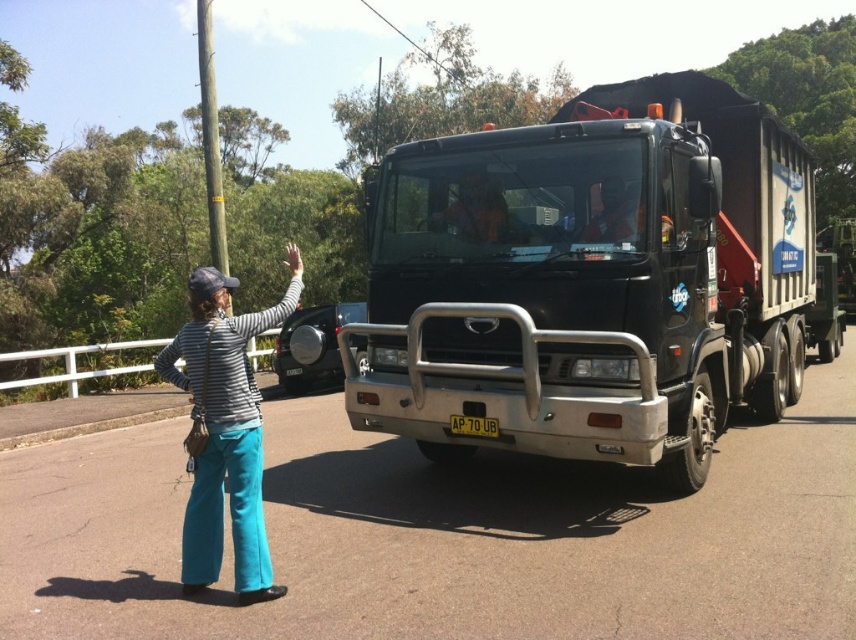
Question: Is black metallic truck at center above yellow plastic license plate at center?

Choices:
 (A) no
 (B) yes

Answer: (B)

Question: Is black metallic truck at center closer to the viewer compared to yellow plastic license plate at center?

Choices:
 (A) yes
 (B) no

Answer: (A)

Question: Which object is closer to the camera taking this photo?

Choices:
 (A) black metallic truck at center
 (B) yellow plastic license plate at center
 (C) striped fabric shirt at left

Answer: (C)

Question: From the image, what is the correct spatial relationship of striped fabric shirt at left in relation to yellow plastic license plate at center?

Choices:
 (A) below
 (B) above

Answer: (B)

Question: Which of the following is the closest to the observer?

Choices:
 (A) black metallic truck at center
 (B) yellow plastic license plate at center

Answer: (A)

Question: Among these points, which one is farthest from the camera?

Choices:
 (A) (702, 122)
 (B) (461, 422)
 (C) (194, 272)

Answer: (C)